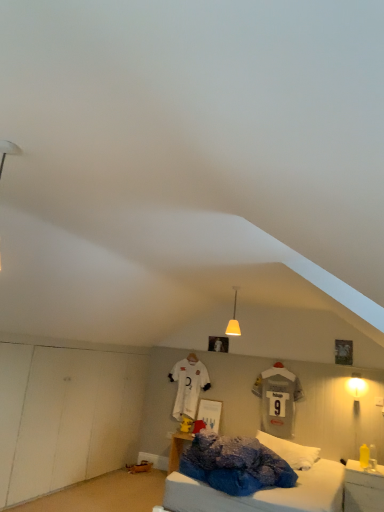
Question: Considering the positions of white fluffy pillow at center and yellow plastic bottle at lower right in the image, is white fluffy pillow at center taller or shorter than yellow plastic bottle at lower right?

Choices:
 (A) tall
 (B) short

Answer: (B)

Question: Is white fluffy pillow at center spatially inside yellow plastic bottle at lower right, or outside of it?

Choices:
 (A) inside
 (B) outside

Answer: (B)

Question: Considering the real-world distances, which object is closest to the yellow plastic bottle at lower right?

Choices:
 (A) matte yellow lampshade at right, the 1th light fixture when ordered from right to left
 (B) matte yellow glass pendant light at center, arranged as the 1th light fixture when viewed from the front
 (C) white fluffy pillow at center

Answer: (C)

Question: Based on their relative distances, which object is farther from the matte yellow glass pendant light at center, arranged as the 1th light fixture when viewed from the front?

Choices:
 (A) white fluffy pillow at center
 (B) yellow plastic bottle at lower right
 (C) matte yellow lampshade at right, which is the second light fixture in top-to-bottom order

Answer: (B)